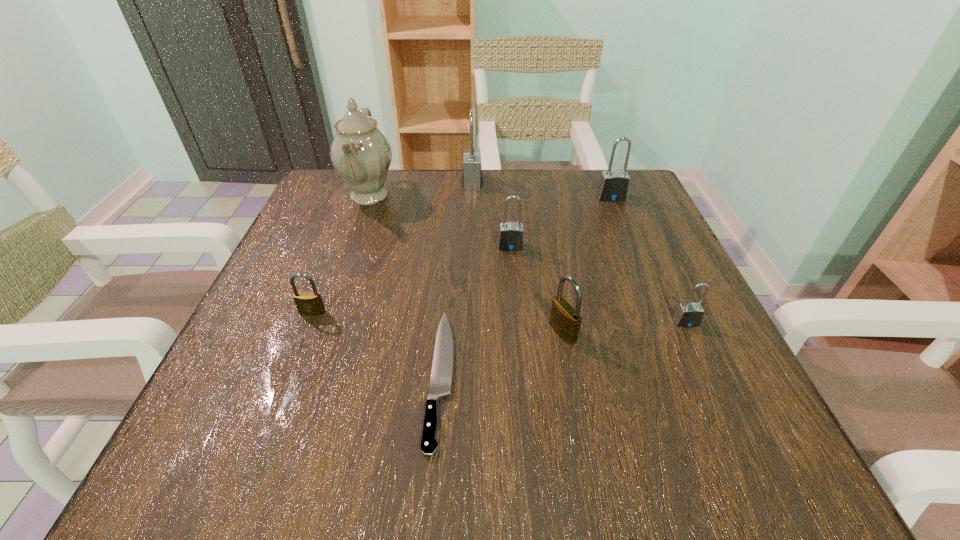
At what (x,y) coordinates should I click in order to perform the action: click on the tallest object. Please return your answer as a coordinate pair (x, y). Looking at the image, I should click on (360, 153).

The height and width of the screenshot is (540, 960). I want to click on the second tallest object, so click(472, 172).

This screenshot has height=540, width=960. What are the coordinates of `the tallest padlock` in the screenshot? It's located at (472, 172).

Where is `the fifth shortest padlock`? The height and width of the screenshot is (540, 960). the fifth shortest padlock is located at coordinates (613, 186).

At what (x,y) coordinates should I click in order to perform the action: click on the third smallest gray padlock. Please return your answer as a coordinate pair (x, y). The height and width of the screenshot is (540, 960). Looking at the image, I should click on (613, 186).

Where is `the second gray padlock from left to right`? The height and width of the screenshot is (540, 960). the second gray padlock from left to right is located at coordinates (511, 234).

The width and height of the screenshot is (960, 540). Find the location of `the fifth object from left to right`. the fifth object from left to right is located at coordinates (511, 234).

The width and height of the screenshot is (960, 540). Identify the location of the third object from right to left. (565, 320).

Identify the location of the nearer brass padlock. (565, 320).

The height and width of the screenshot is (540, 960). In order to click on the fourth farthest padlock in this screenshot , I will do `click(308, 303)`.